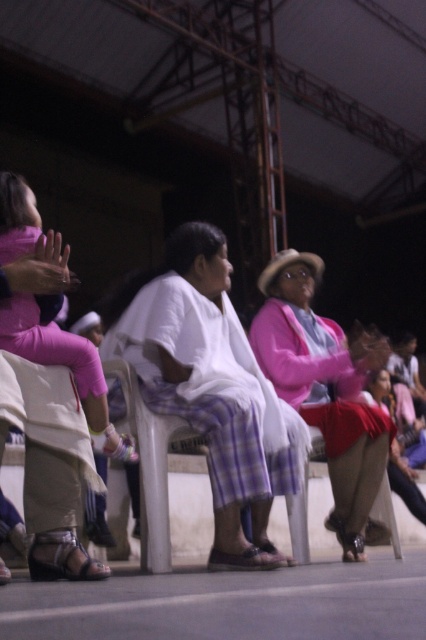
Consider the image. Can you confirm if pink fabric jacket at center is positioned above pink fabric pants at left?

No, pink fabric jacket at center is not above pink fabric pants at left.

Which is more to the left, pink fabric jacket at center or pink fabric pants at left?

From the viewer's perspective, pink fabric pants at left appears more on the left side.

Which is behind, point (350, 435) or point (9, 305)?

Point (350, 435)

Where is `pink fabric jacket at center`? The height and width of the screenshot is (640, 426). pink fabric jacket at center is located at coordinates (325, 387).

Which is above, pink fabric jacket at center or brown leather sandal at lower center?

pink fabric jacket at center is above.

Who is shorter, pink fabric jacket at center or brown leather sandal at lower center?

brown leather sandal at lower center is shorter.

This screenshot has width=426, height=640. Describe the element at coordinates (325, 387) in the screenshot. I see `pink fabric jacket at center` at that location.

The image size is (426, 640). Identify the location of pink fabric jacket at center. (325, 387).

Is point (51, 545) less distant than point (265, 548)?

Yes, point (51, 545) is in front of point (265, 548).

Does white leather sandal at lower left appear on the left side of brown leather sandal at lower center?

Indeed, white leather sandal at lower left is positioned on the left side of brown leather sandal at lower center.

Identify the location of white leather sandal at lower left. This screenshot has height=640, width=426. (63, 557).

I want to click on white leather sandal at lower left, so click(63, 557).